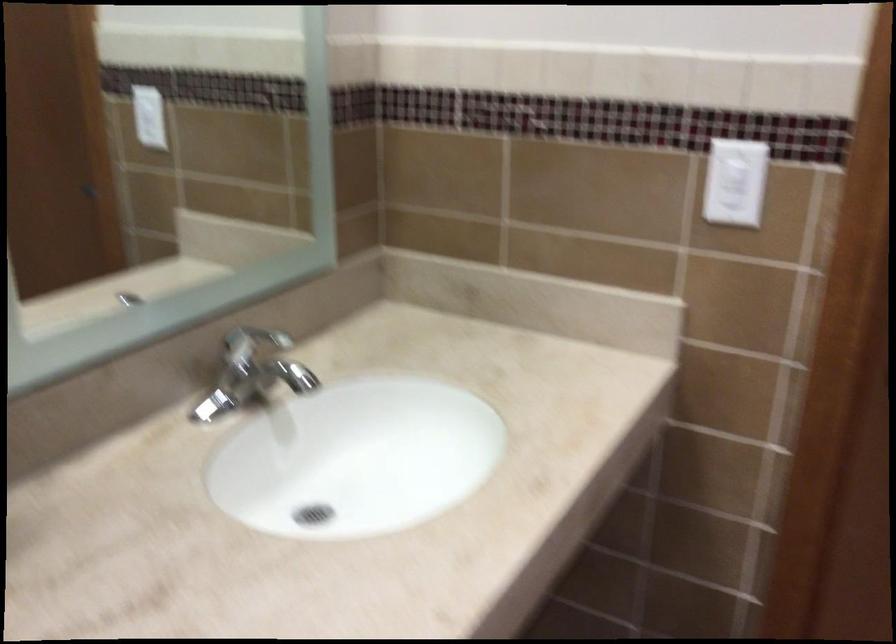
How did the camera likely rotate?

The camera rotated toward right-down.